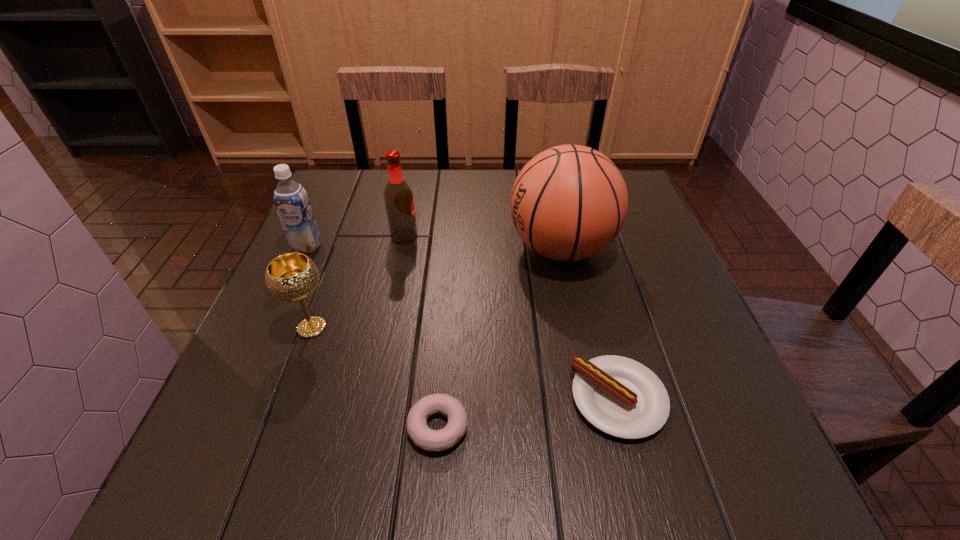
The height and width of the screenshot is (540, 960). What are the coordinates of `basketball` in the screenshot? It's located at (568, 203).

I want to click on the fourth object from right to left, so click(x=398, y=197).

What are the coordinates of `the leftmost object` in the screenshot? It's located at (292, 203).

This screenshot has width=960, height=540. Find the location of `the fourth farthest object`. the fourth farthest object is located at coordinates (293, 276).

Where is `the fourth tallest object`? The width and height of the screenshot is (960, 540). the fourth tallest object is located at coordinates (293, 276).

Find the location of a particular element. The height and width of the screenshot is (540, 960). the second shortest object is located at coordinates (621, 397).

I want to click on the fourth object from left to right, so click(x=422, y=436).

You are a GUI agent. You are given a task and a screenshot of the screen. Output one action in this format:
    pyautogui.click(x=<x>, y=<y>)
    Task: Click on the shortest object
    This screenshot has height=540, width=960.
    Given the screenshot: What is the action you would take?
    pyautogui.click(x=422, y=436)

You are a GUI agent. You are given a task and a screenshot of the screen. Output one action in this format:
    pyautogui.click(x=<x>, y=<y>)
    Task: Click on the free location located on the surface of the basketball near the brand logo
    
    Given the screenshot: What is the action you would take?
    pyautogui.click(x=446, y=248)

Locate an element on the screen. vacant space located 0.380m on the surface of the basketball near the brand logo is located at coordinates (351, 248).